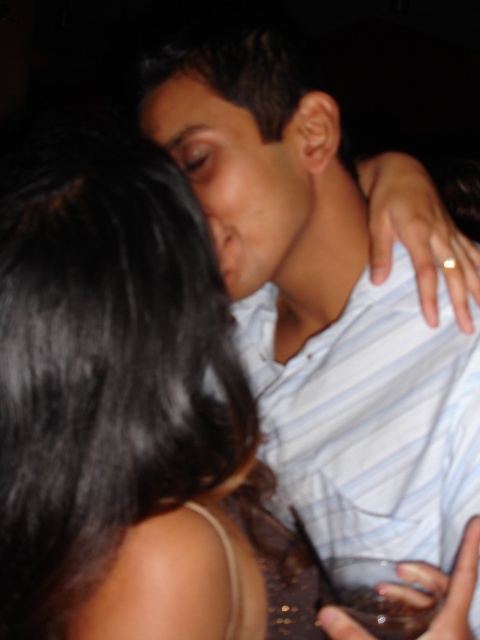
Between point (334, 308) and point (215, 93), which one is positioned behind?

Positioned behind is point (334, 308).

Is white striped shirt at center smaller than matte skin forehead at upper center?

No.

Between point (419, 435) and point (163, 116), which one is positioned behind?

The point (419, 435) is behind.

Image resolution: width=480 pixels, height=640 pixels. What are the coordinates of `white striped shirt at center` in the screenshot? It's located at (328, 316).